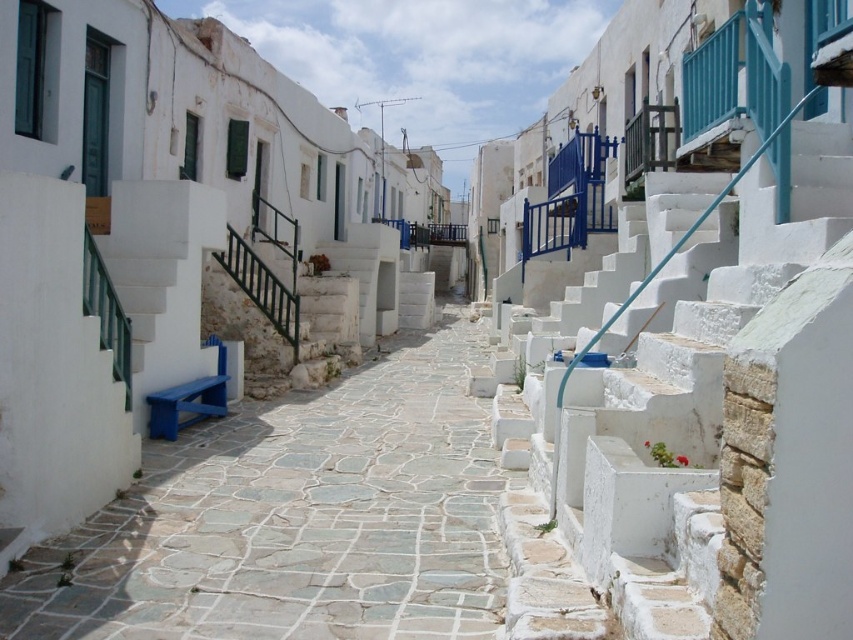
Question: Can you confirm if white stone stairs at upper right is smaller than stone paved path at center?

Choices:
 (A) no
 (B) yes

Answer: (B)

Question: Can you confirm if white stone stairs at upper right is positioned to the left of stone paved path at center?

Choices:
 (A) yes
 (B) no

Answer: (B)

Question: Among these points, which one is farthest from the camera?

Choices:
 (A) (709, 460)
 (B) (138, 524)

Answer: (B)

Question: Which object appears farthest from the camera in this image?

Choices:
 (A) stone paved path at center
 (B) white stone stairs at upper right

Answer: (A)

Question: Can you confirm if white stone stairs at upper right is thinner than stone paved path at center?

Choices:
 (A) yes
 (B) no

Answer: (A)